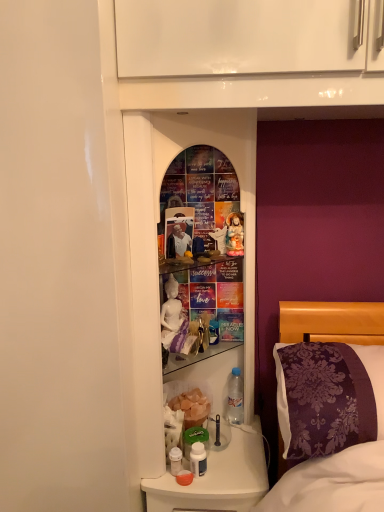
I want to click on vacant space in front of clear plastic bottle at lower center, which appears as the 2th bottle when ordered from the bottom, so point(238,451).